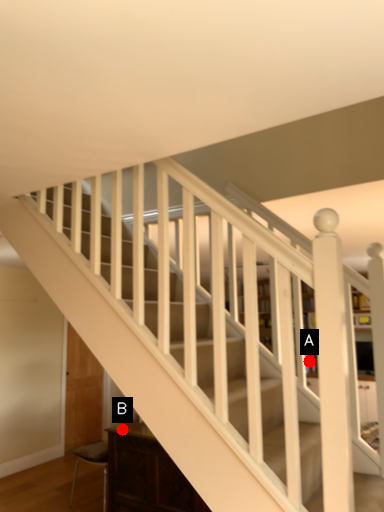
Question: Two points are circled on the image, labeled by A and B beside each circle. Which point is closer to the camera?

Choices:
 (A) A is closer
 (B) B is closer

Answer: (A)